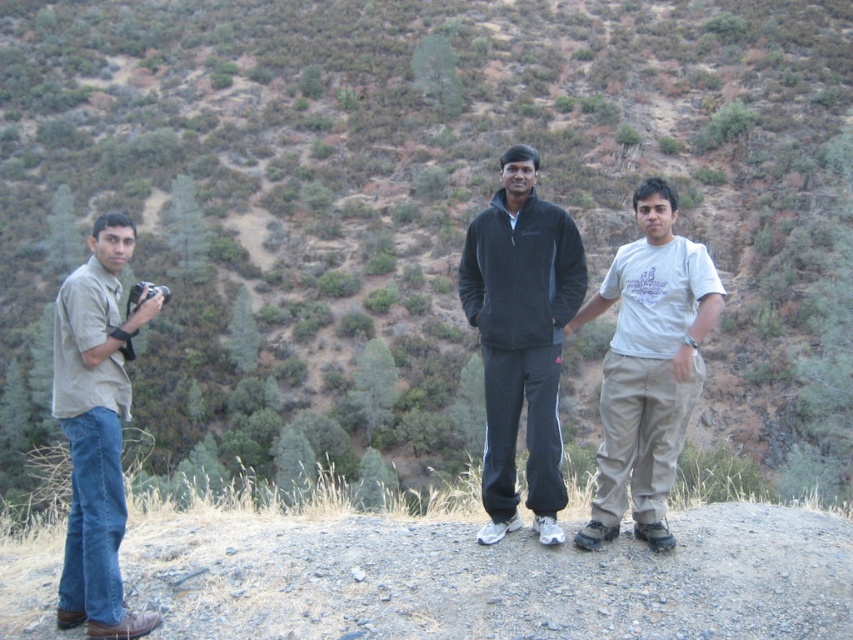
Question: Observing the image, what is the correct spatial positioning of black fleece tracksuit at center in reference to white cotton shirt at center?

Choices:
 (A) below
 (B) above

Answer: (B)

Question: Which object is positioned farthest from the black fleece tracksuit at center?

Choices:
 (A) white cotton shirt at center
 (B) beige cotton shirt at left
 (C) gray gravel at center

Answer: (B)

Question: Which of these objects is positioned farthest from the beige cotton shirt at left?

Choices:
 (A) black fleece tracksuit at center
 (B) white cotton shirt at center

Answer: (B)

Question: Is gray gravel at center below beige cotton shirt at left?

Choices:
 (A) no
 (B) yes

Answer: (B)

Question: Can you confirm if gray gravel at center is positioned below black fleece tracksuit at center?

Choices:
 (A) no
 (B) yes

Answer: (B)

Question: Among these objects, which one is farthest from the camera?

Choices:
 (A) beige cotton shirt at left
 (B) white cotton shirt at center

Answer: (B)